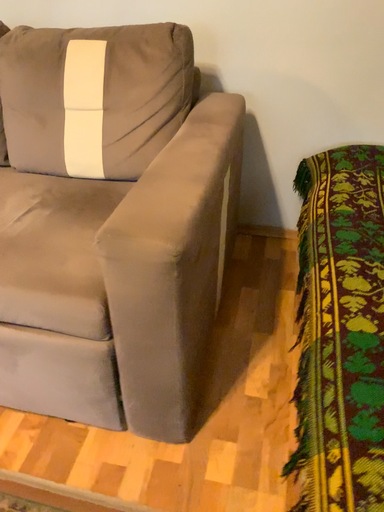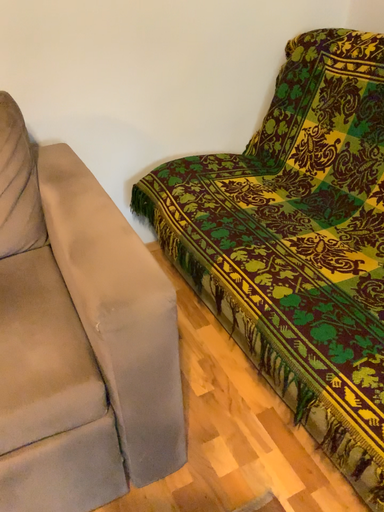
Question: How did the camera likely rotate when shooting the video?

Choices:
 (A) rotated right
 (B) rotated left

Answer: (A)